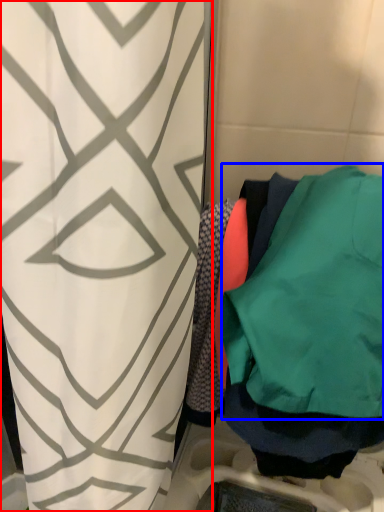
Question: Which point is further to the camera, curtain (highlighted by a red box) or sweatshirt (highlighted by a blue box)?

Choices:
 (A) curtain
 (B) sweatshirt

Answer: (B)